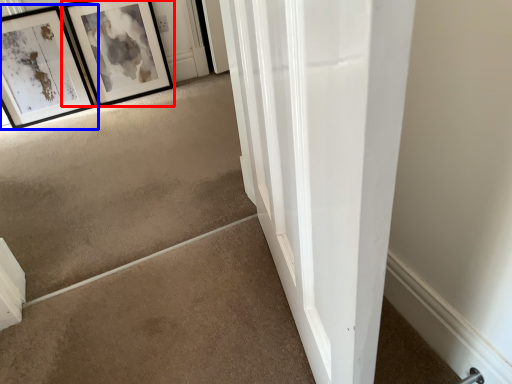
Question: Among these objects, which one is nearest to the camera, picture frame (highlighted by a red box) or picture frame (highlighted by a blue box)?

Choices:
 (A) picture frame
 (B) picture frame

Answer: (B)